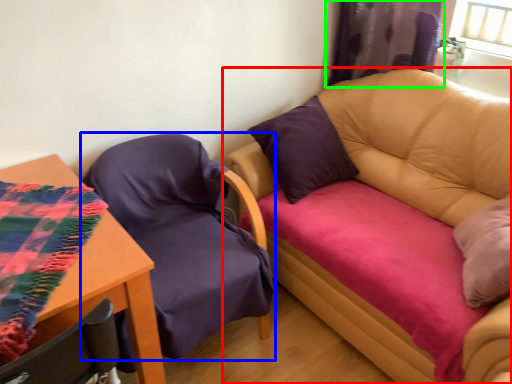
Question: Which object is the farthest from studio couch (highlighted by a red box)? Choose among these: chair (highlighted by a blue box) or curtain (highlighted by a green box).

Choices:
 (A) chair
 (B) curtain

Answer: (A)